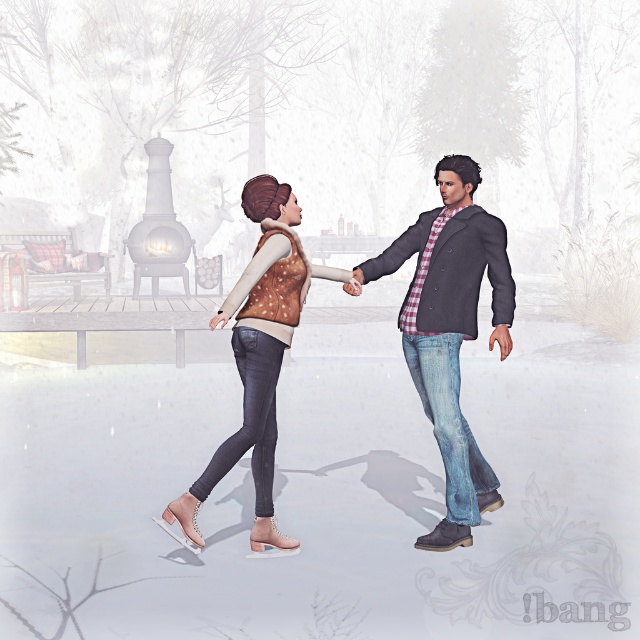
Question: Which of the following is the farthest from the observer?

Choices:
 (A) (355, 269)
 (B) (461, 481)

Answer: (A)

Question: Which of the following is the closest to the observer?

Choices:
 (A) matte brown vest at center
 (B) denim jacket at right

Answer: (A)

Question: Does matte brown vest at center appear under denim jacket at right?

Choices:
 (A) no
 (B) yes

Answer: (B)

Question: Is matte brown vest at center positioned in front of denim jacket at right?

Choices:
 (A) yes
 (B) no

Answer: (A)

Question: Is matte brown vest at center bigger than denim jacket at right?

Choices:
 (A) yes
 (B) no

Answer: (A)